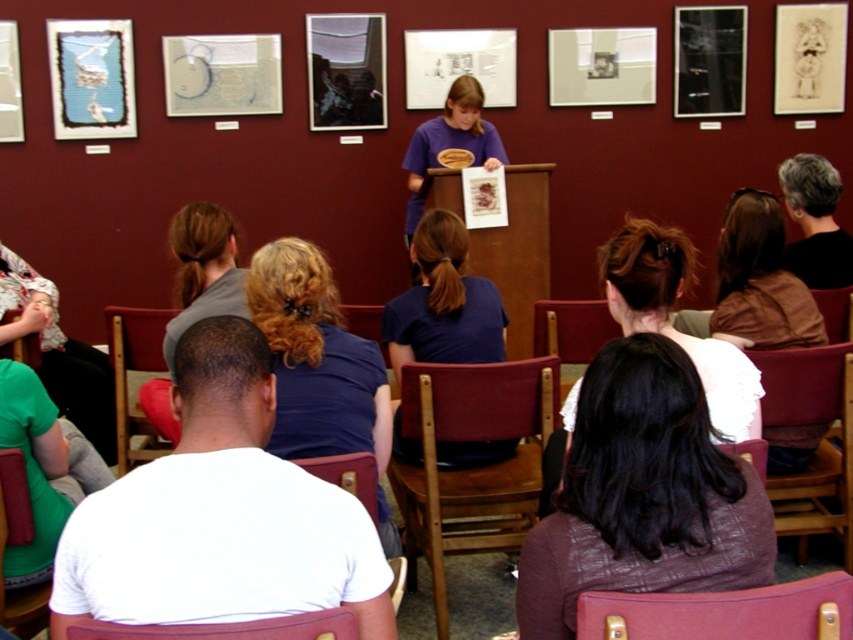
You are organizing a small event in the gallery and need to seat two guests. You have a green fabric chair at lower left and a brown wood chair at center. Which chair takes up more space in the room?

The brown wood chair at center takes up more space than the green fabric chair at lower left because the green fabric chair at lower left occupies less space than brown wood chair at center.

You are standing in the art gallery and want to reach the point marked as point (799, 337). If your walking speed is 1.2 meters per second, how many seconds will it take you to reach that point?

The distance between you and point (799, 337) is 2.61 meters. At a speed of 1.2 meters per second, it will take approximately 2.18 seconds to reach the point.

You are an attendee at the art gallery event and need to move from your current seat, the green fabric chair at lower left, to the brown wood chair at center to ask a question. Considering the distance between them, is it possible to walk directly between the two chairs without needing to go around any obstacles?

The green fabric chair at lower left is 5.79 feet away from the brown wood chair at center. Since this distance allows for a direct path and there are no mentioned obstacles in the scene description, you can walk directly between the two chairs.